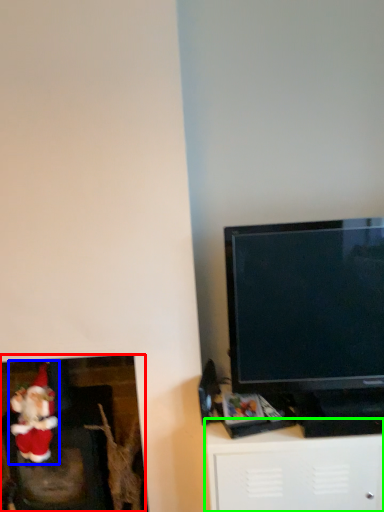
Question: Which is nearer to the fireplace (highlighted by a red box)? santa claus (highlighted by a blue box) or furniture (highlighted by a green box).

Choices:
 (A) santa claus
 (B) furniture

Answer: (A)